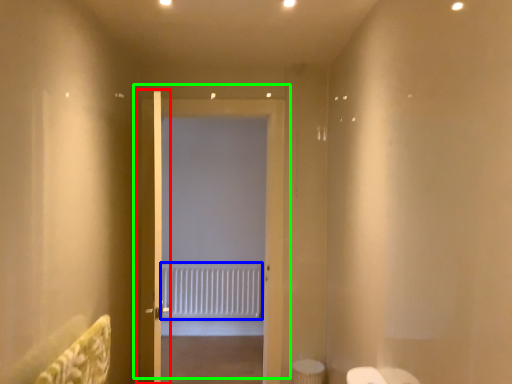
Question: Considering the real-world distances, which object is farthest from door (highlighted by a red box)? radiator (highlighted by a blue box) or door (highlighted by a green box)?

Choices:
 (A) radiator
 (B) door

Answer: (A)